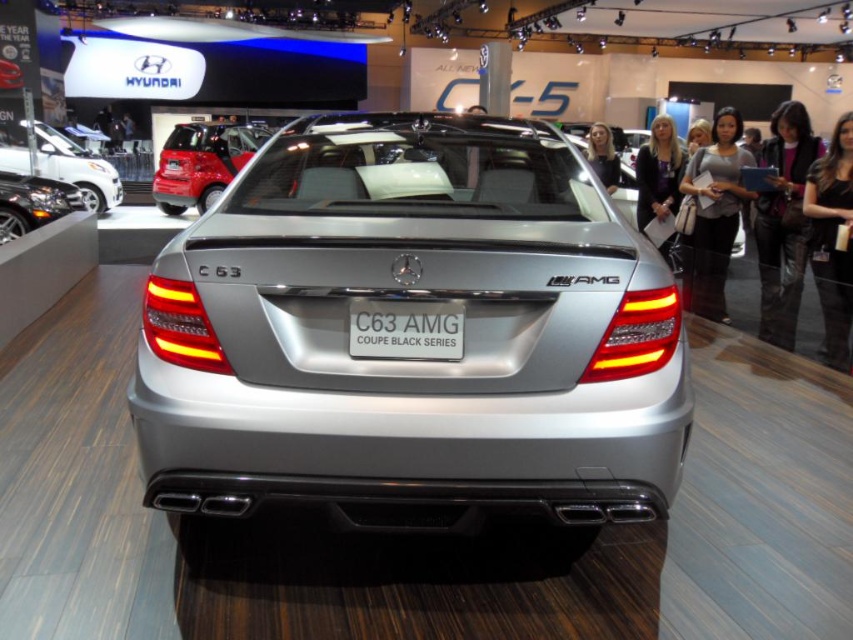
You are a photographer at an auto show. You want to take a photo of the satin silver car at center and the silver metallic car at right. Based on their positions, which car should you focus on first to ensure both are in the frame?

The satin silver car at center is in front of the silver metallic car at right, so you should focus on the silver metallic car at right first to ensure both are in the frame.

You are at an auto show and want to take a photo of both the satin silver car at center and the silver metallic car at right. Since you can only stand in one spot, which car should you position yourself closer to in order to capture both in the frame?

You should position yourself closer to the satin silver car at center because it is to the left of the silver metallic car at right, allowing both to be included in the frame when centered.

You are at an auto show and want to take a photo of both the silver metallic car at right and the shiny red car at upper left. Which car should you position yourself closer to in order to capture both in the same frame?

You should position yourself closer to the shiny red car at upper left because the silver metallic car at right is to the right of it, allowing both cars to be included in the frame when centered on the red car.